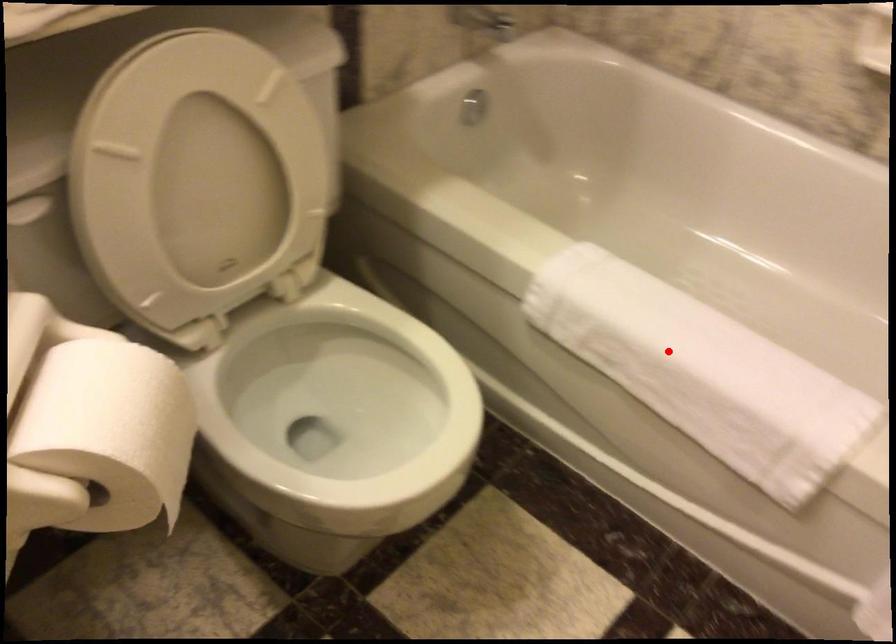
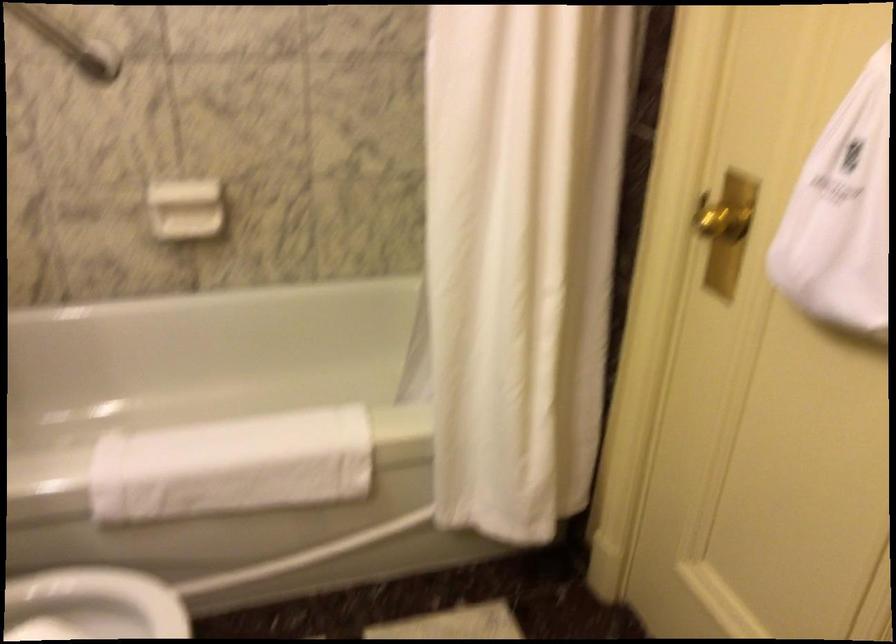
Question: I am providing you with two images of the same scene from different viewpoints. Given a red point in image1, look at the same physical point in image2. Is it:

Choices:
 (A) Closer to the viewpoint
 (B) Farther from the viewpoint

Answer: (B)